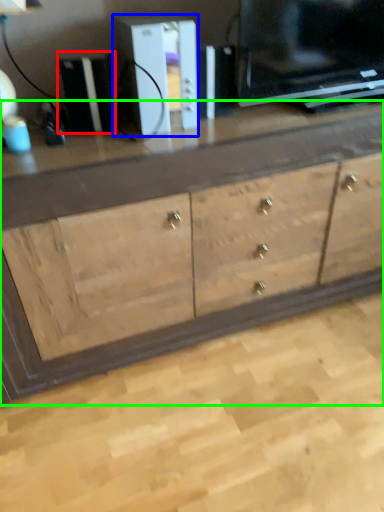
Question: Which object is the closest to the appliance (highlighted by a red box)? Choose among these: appliance (highlighted by a blue box) or chest of drawers (highlighted by a green box).

Choices:
 (A) appliance
 (B) chest of drawers

Answer: (A)